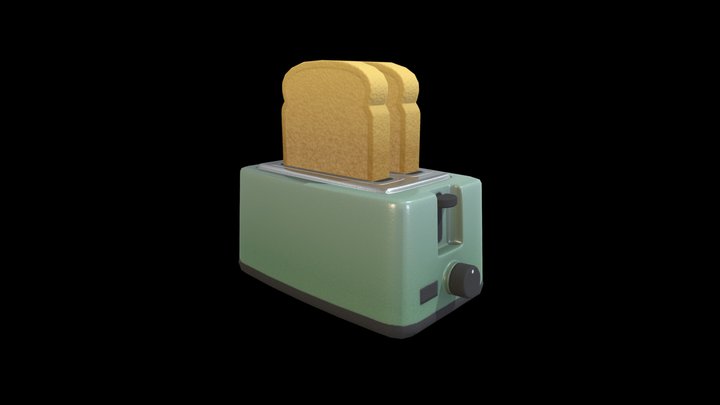
Image resolution: width=720 pixels, height=405 pixels. I want to click on switch, so click(444, 201).